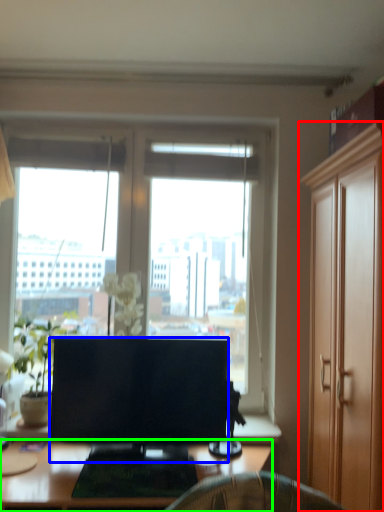
Question: Estimate the real-world distances between objects in this image. Which object is farther from cabinetry (highlighted by a red box), television (highlighted by a blue box) or desk (highlighted by a green box)?

Choices:
 (A) television
 (B) desk

Answer: (B)